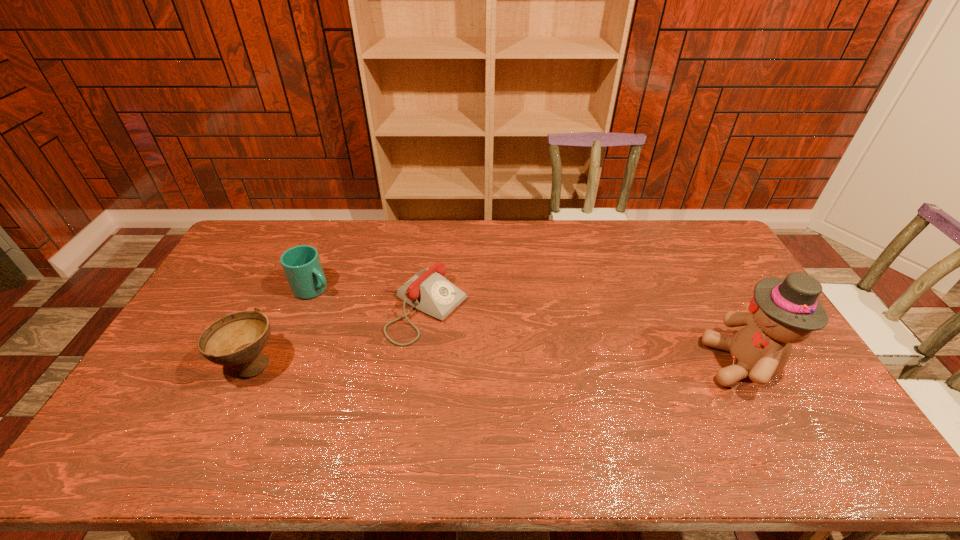
The image size is (960, 540). Find the location of `soup bowl`. soup bowl is located at coordinates (237, 339).

Locate an element on the screen. the rightmost object is located at coordinates (783, 311).

You are a GUI agent. You are given a task and a screenshot of the screen. Output one action in this format:
    pyautogui.click(x=<x>, y=<y>)
    Task: Click on the tallest object
    Image resolution: width=960 pixels, height=540 pixels.
    Given the screenshot: What is the action you would take?
    pyautogui.click(x=783, y=311)

Where is `the shortest object`? the shortest object is located at coordinates (428, 291).

You are a GUI agent. You are given a task and a screenshot of the screen. Output one action in this format:
    pyautogui.click(x=<x>, y=<y>)
    Task: Click on the telephone
    
    Given the screenshot: What is the action you would take?
    pyautogui.click(x=428, y=291)

You are a GUI agent. You are given a task and a screenshot of the screen. Output one action in this format:
    pyautogui.click(x=<x>, y=<y>)
    Task: Click on the cup
    This screenshot has width=960, height=540.
    Given the screenshot: What is the action you would take?
    pyautogui.click(x=301, y=264)

At what (x,y) coordinates should I click in order to perform the action: click on vacant space located 0.190m on the right of the soup bowl. Please return your answer as a coordinate pair (x, y). The width and height of the screenshot is (960, 540). Looking at the image, I should click on (349, 364).

At what (x,y) coordinates should I click in order to perform the action: click on blank space located 0.260m on the front-facing side of the rag_doll. Please return your answer as a coordinate pair (x, y). Looking at the image, I should click on [x=614, y=363].

Find the location of a particular element. free spot located on the front-facing side of the rag_doll is located at coordinates (653, 363).

In order to click on free space located 0.210m on the front-facing side of the rag_doll in this screenshot , I will do point(633,363).